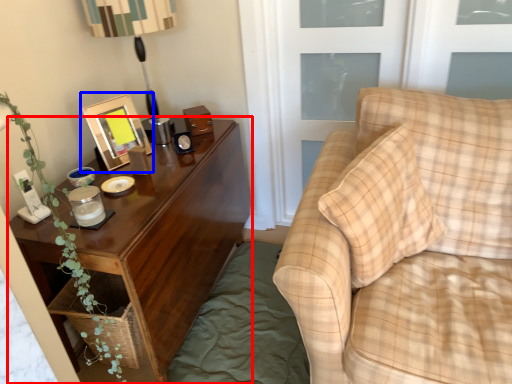
Question: Which object appears closest to the camera in this image, nightstand (highlighted by a red box) or picture frame (highlighted by a blue box)?

Choices:
 (A) nightstand
 (B) picture frame

Answer: (A)